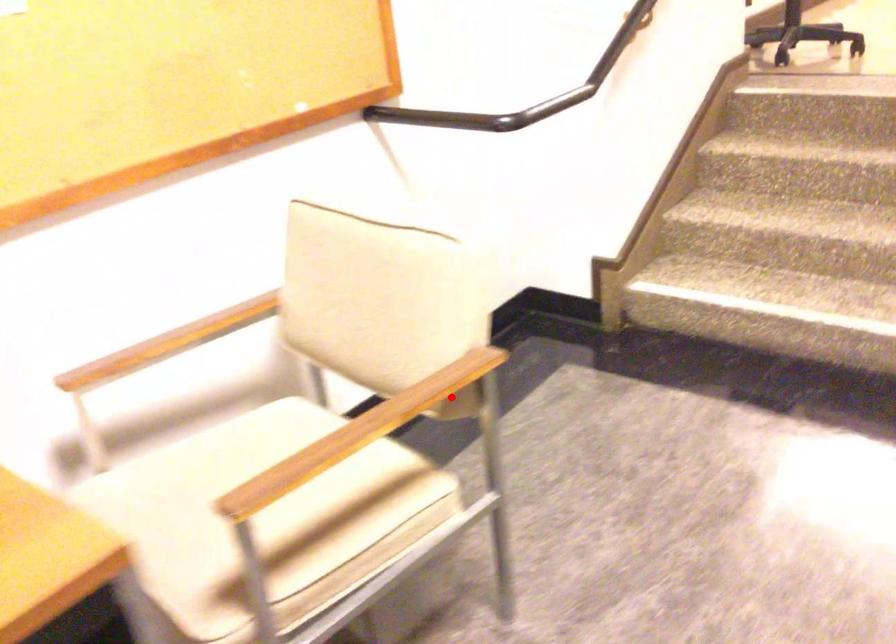
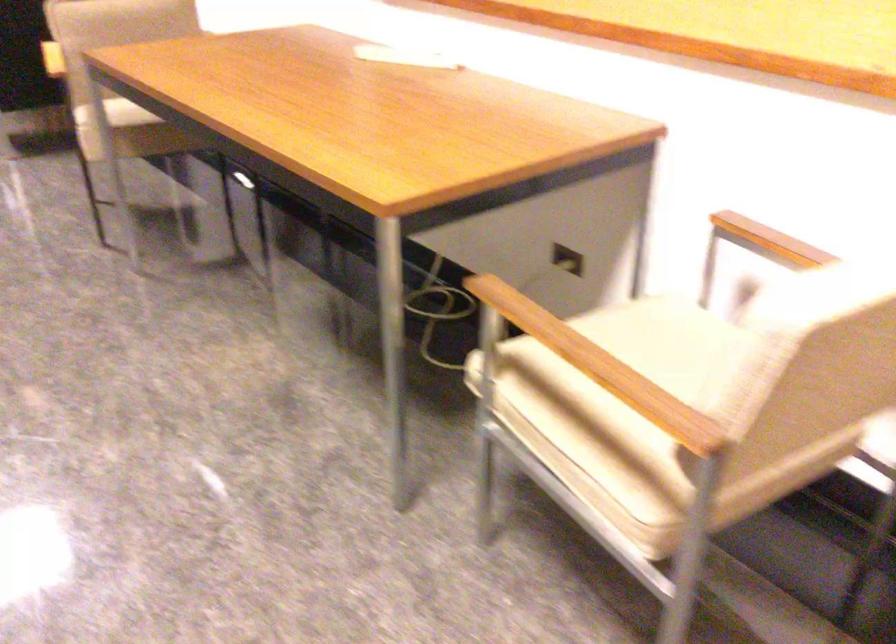
Question: I am providing you with two images of the same scene from different viewpoints. Image1 has a red point marked. In image2, the corresponding 3D location appears at what relative position? Reply with the corresponding letter.

Choices:
 (A) Closer
 (B) Farther

Answer: (A)